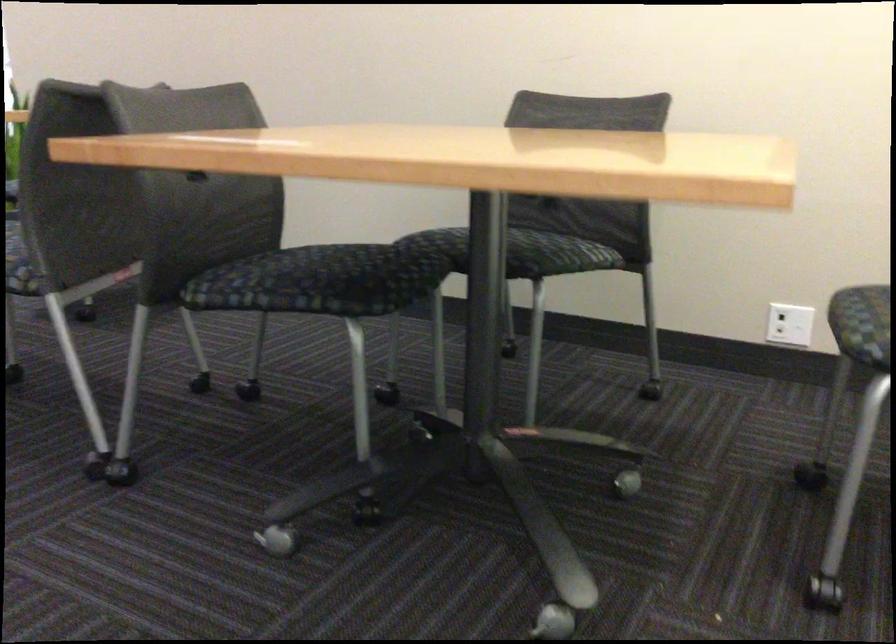
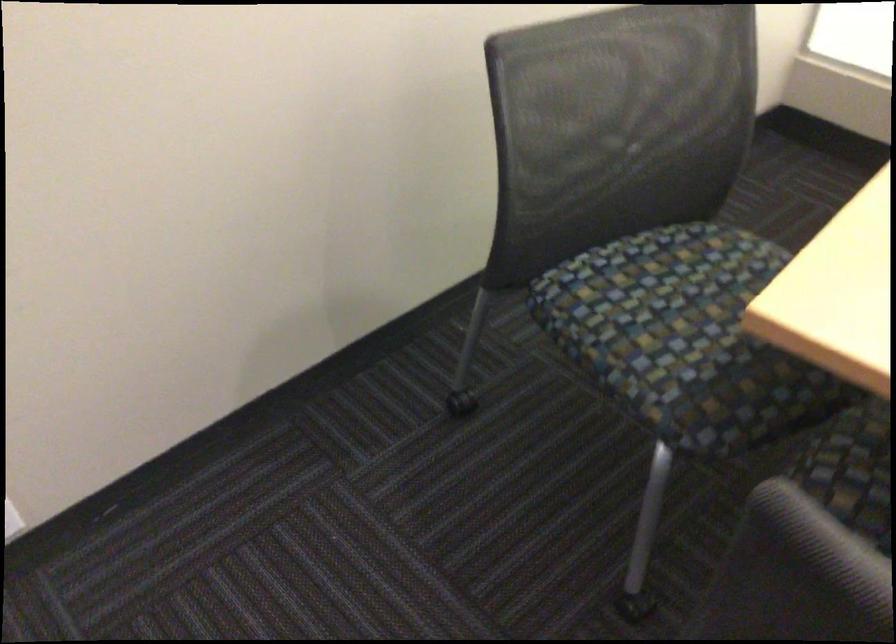
In the second image, find the point that corresponds to the point at 375,245 in the first image.

(851, 469)